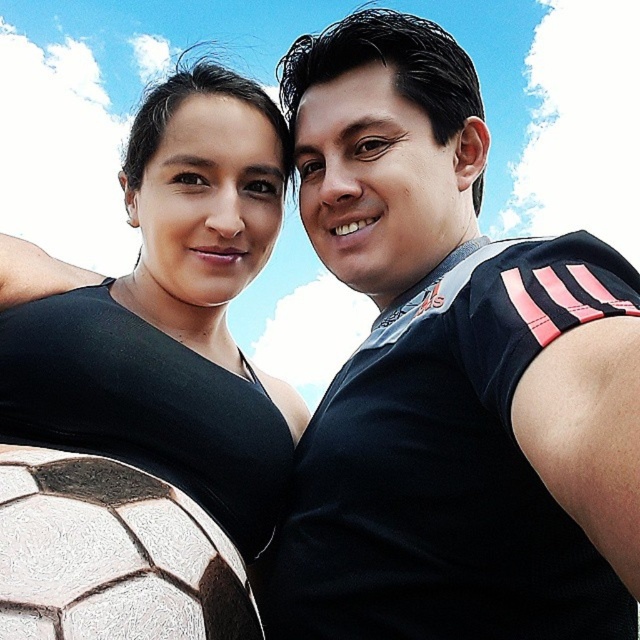
In the scene shown: You are trying to decide which item to take from the center of the image for a costume party. The black matte jersey at center and the matte black dress at center are both options. Based on their positions, which one is easier to reach if you are standing to the left of both items?

The black matte jersey at center is to the right of the matte black dress at center, so if you are standing to the left of both items, the matte black dress at center is closer and easier to reach.

You are a photographer trying to capture the perfect shot of the black matte jersey at center. Based on the coordinates provided, where should you position your camera to ensure the jersey is centered in the frame?

The black matte jersey at center is located at coordinates point (451, 374), so positioning the camera to aim directly at those coordinates will center the jersey in the frame.

You are a photographer standing at the edge of the scene and want to take a photo of both the black matte jersey at center and the matte black dress at center. Given that your camera has a maximum focus range of 8 feet, will you be able to capture both subjects in focus without moving closer?

The black matte jersey at center is 8.82 feet away from the matte black dress at center. Since the distance between them exceeds the camera maximum focus range of 8 feet, you cannot capture both subjects in focus without moving closer.